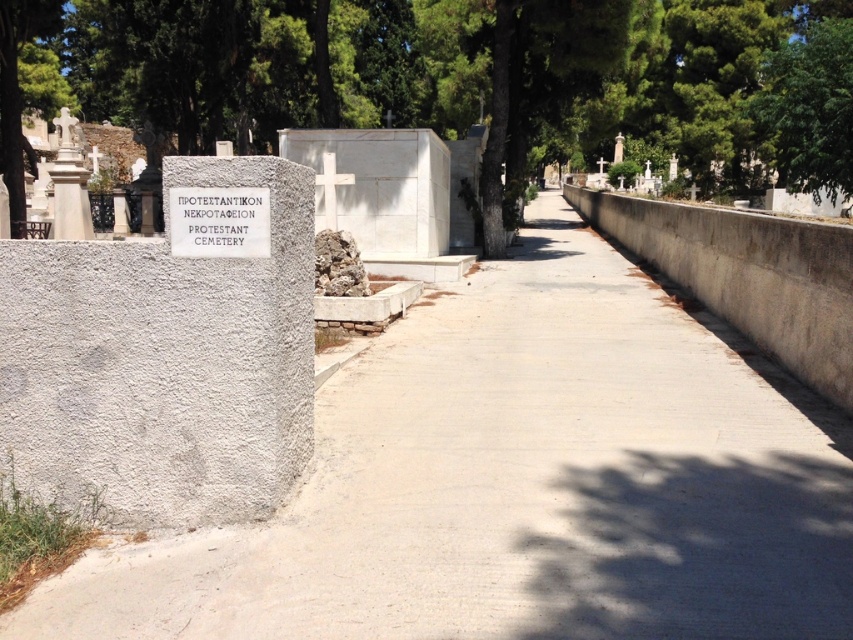
You are planning to place a new bench in the Protestant Cemetery. The bench requires a space that is wider than the white marble cross at center. Can the space occupied by the green leafy tree at center accommodate the bench?

The green leafy tree at center has a larger width than the white marble cross at center, so the space occupied by the green leafy tree at center is wide enough to accommodate the bench.

Based on the provided scene description, where is the white marble cross at center located in the image?

The white marble cross at center is located at point coordinates of [378,186].